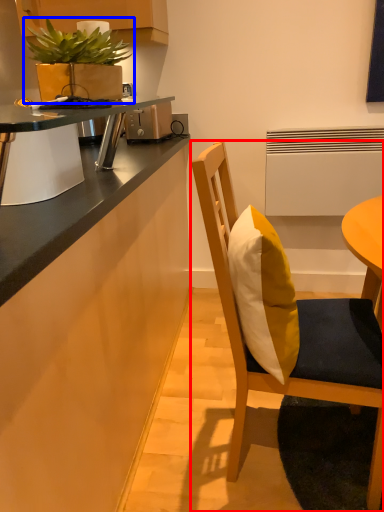
Question: Which point is further to the camera, chair (highlighted by a red box) or houseplant (highlighted by a blue box)?

Choices:
 (A) chair
 (B) houseplant

Answer: (B)